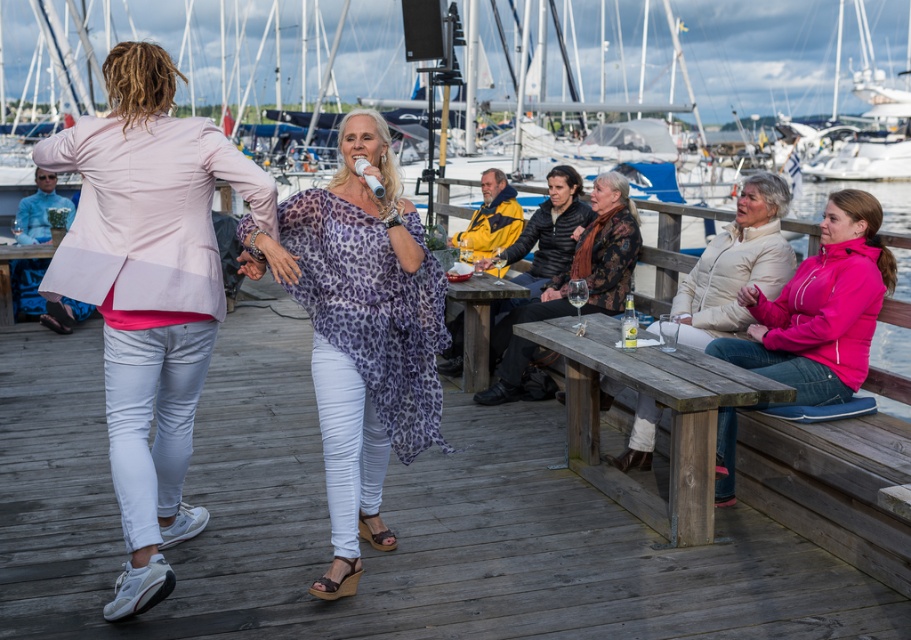
This screenshot has height=640, width=911. What do you see at coordinates (820, 308) in the screenshot? I see `pink fleece jacket at right` at bounding box center [820, 308].

Consider the image. Who is taller, pink fleece jacket at right or beige puffer jacket at lower right?

Standing taller between the two is pink fleece jacket at right.

Find the location of a particular element. The image size is (911, 640). pink fleece jacket at right is located at coordinates (820, 308).

The image size is (911, 640). Describe the element at coordinates (149, 291) in the screenshot. I see `pink fabric jacket at left` at that location.

Does pink fabric jacket at left lie in front of wooden picnic table at center?

Yes, pink fabric jacket at left is in front of wooden picnic table at center.

Who is more distant from viewer, [162,60] or [476,314]?

The point [476,314] is more distant.

Where is `pink fabric jacket at left`? The height and width of the screenshot is (640, 911). pink fabric jacket at left is located at coordinates (149, 291).

Does pink fabric jacket at left have a greater height compared to wooden picnic table at lower right?

Yes.

Locate an element on the screen. pink fabric jacket at left is located at coordinates (149, 291).

Identify the location of pink fabric jacket at left. This screenshot has height=640, width=911. (149, 291).